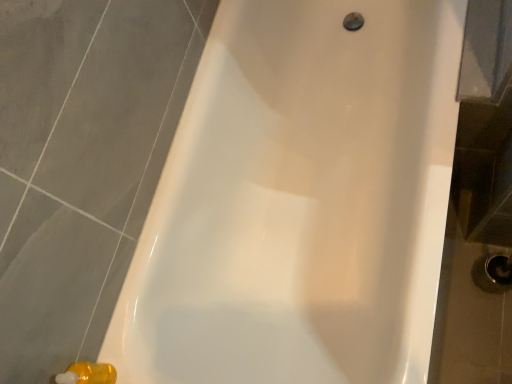
Locate an element on the screen. translucent yellow soap at lower left is located at coordinates (88, 374).

What do you see at coordinates (88, 374) in the screenshot?
I see `translucent yellow soap at lower left` at bounding box center [88, 374].

The height and width of the screenshot is (384, 512). What are the coordinates of `translucent yellow soap at lower left` in the screenshot? It's located at (88, 374).